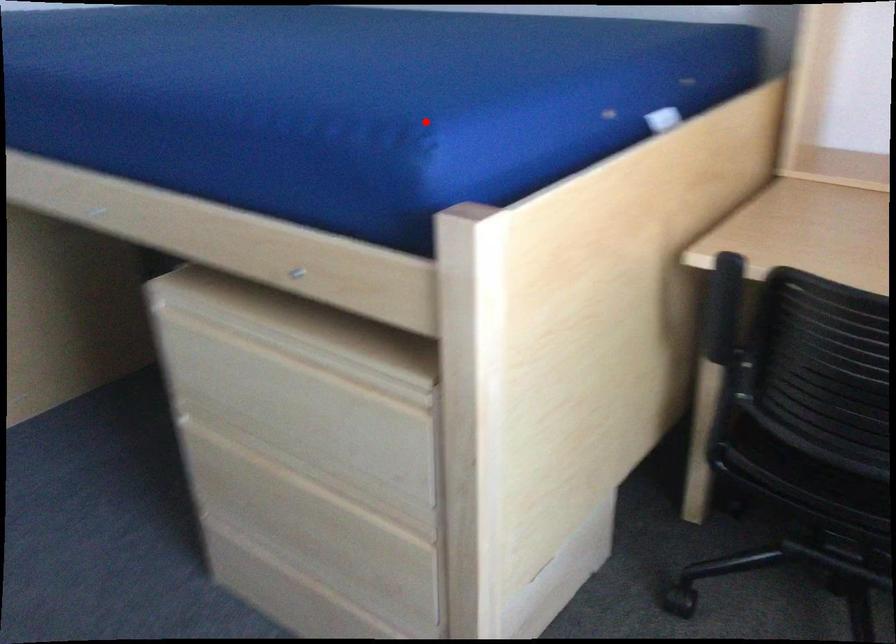
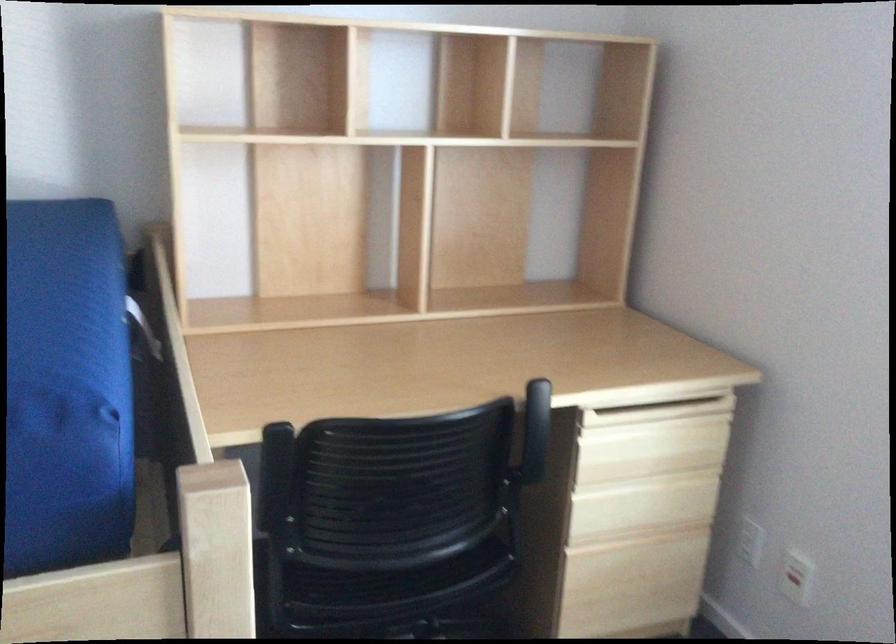
Find the pixel in the second image that matches the highlighted location in the first image.

(66, 388)